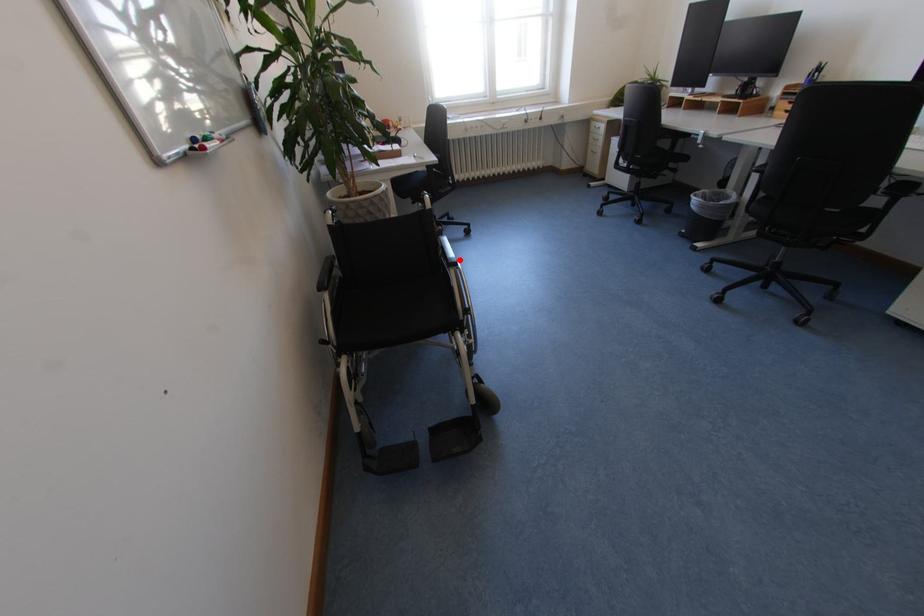
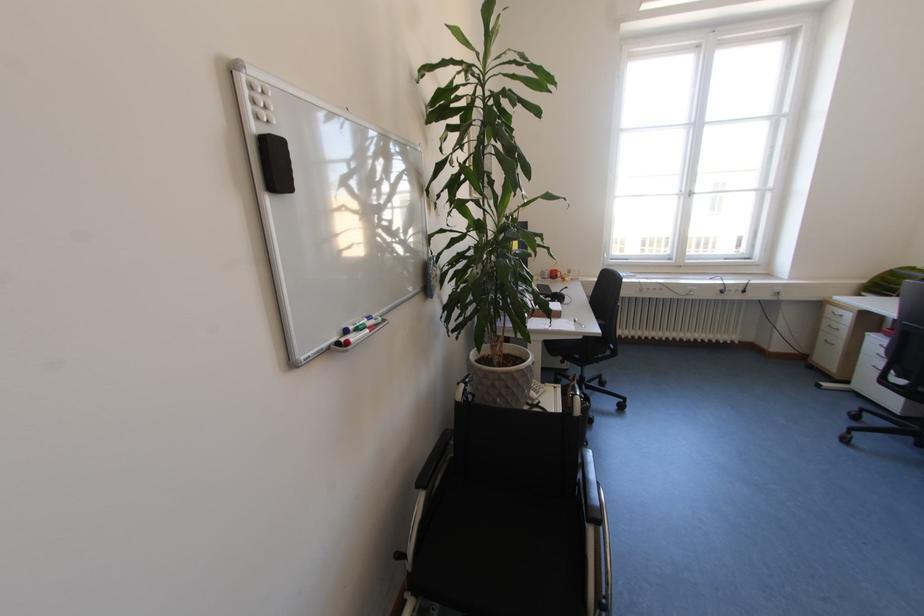
Question: I am providing you with two images of the same scene from different viewpoints. Given a red point in image1, look at the same physical point in image2. Is it:

Choices:
 (A) Closer to the viewpoint
 (B) Farther from the viewpoint

Answer: (B)